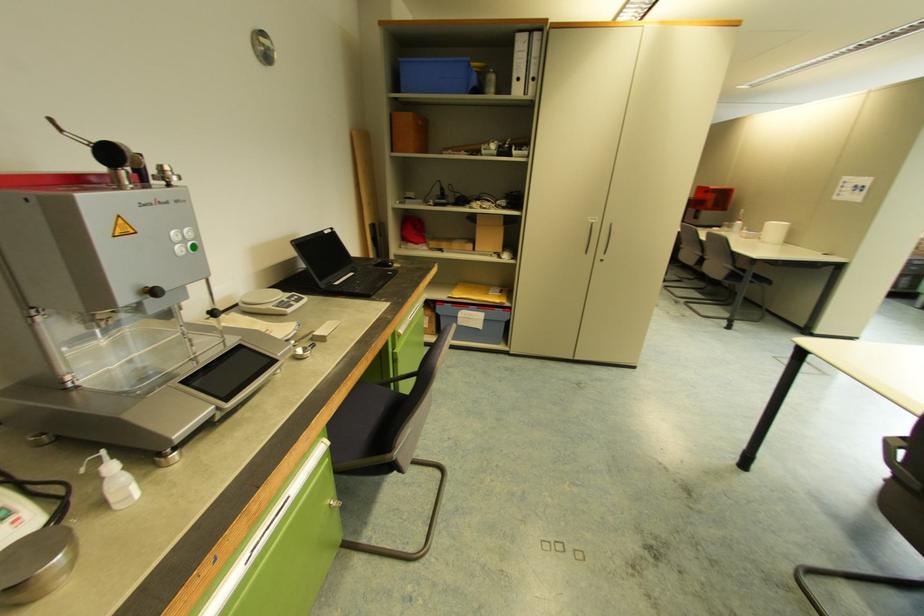
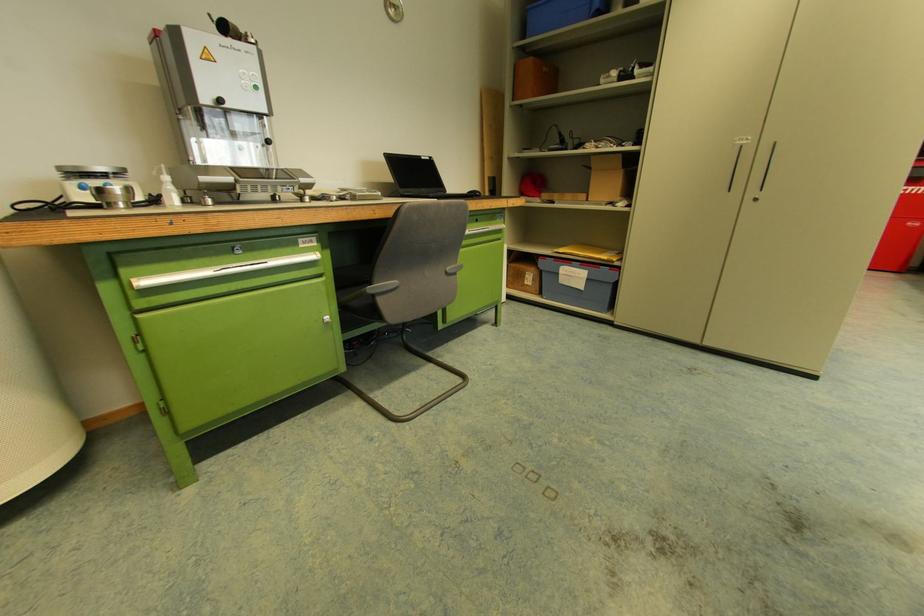
In the second image, find the point that corresponds to (456,294) in the first image.

(563, 249)